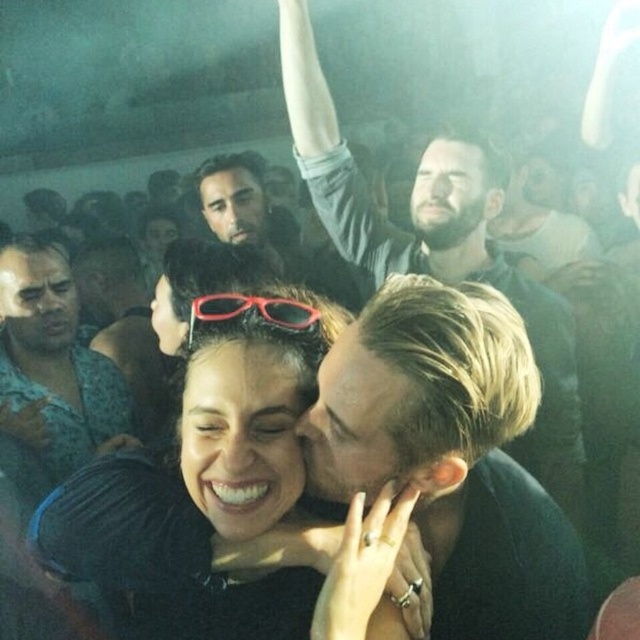
Does blonde hair at center appear on the left side of rubberized plastic glasses at center?

In fact, blonde hair at center is to the right of rubberized plastic glasses at center.

At what (x,y) coordinates should I click in order to perform the action: click on blonde hair at center. Please return your answer as a coordinate pair (x, y). Looking at the image, I should click on (451, 451).

Between matte black sunglasses at center and brushed metal shirt at center, which one has less height?

With less height is matte black sunglasses at center.

Is matte black sunglasses at center closer to the viewer compared to brushed metal shirt at center?

Yes, matte black sunglasses at center is in front of brushed metal shirt at center.

I want to click on matte black sunglasses at center, so click(204, 499).

Between point (284, 84) and point (10, 460), which one is positioned in front?

Point (10, 460)

Who is more distant from viewer, (536, 474) or (3, 388)?

The point (3, 388) is more distant.

Is point (284, 65) closer to viewer compared to point (1, 273)?

That is True.

The height and width of the screenshot is (640, 640). I want to click on bearded man at center, so point(436,243).